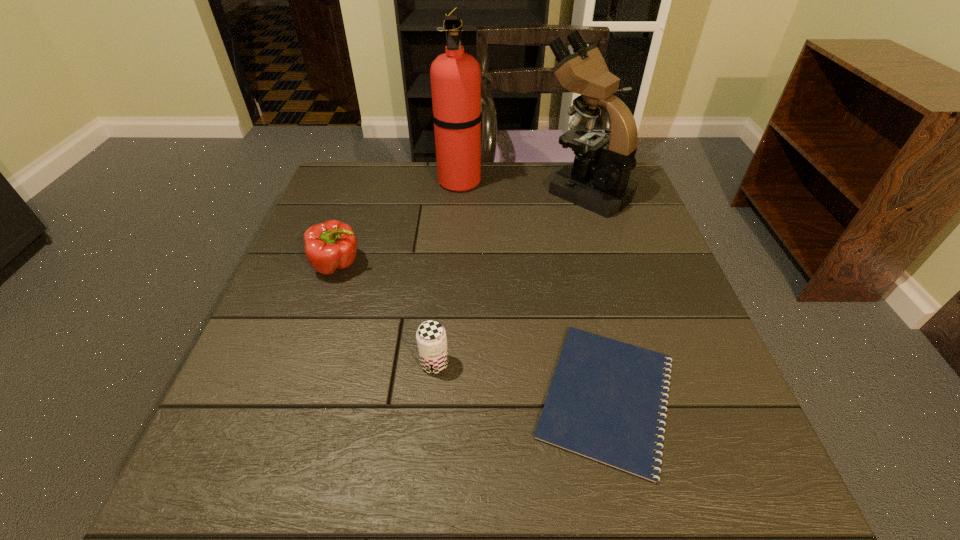
The width and height of the screenshot is (960, 540). What are the coordinates of `blank area at the near edge` in the screenshot? It's located at (593, 490).

At what (x,y) coordinates should I click in order to perform the action: click on vacant space at the left edge of the desktop. Please return your answer as a coordinate pair (x, y). This screenshot has width=960, height=540. Looking at the image, I should click on (286, 302).

Identify the location of free point at the right edge. (642, 206).

Image resolution: width=960 pixels, height=540 pixels. In the image, there is a desktop. Identify the location of vacant area at the far left corner. (382, 171).

Identify the location of free space at the near right corner. (716, 509).

The height and width of the screenshot is (540, 960). I want to click on vacant region between the shortest object and the microscope, so click(x=596, y=293).

The image size is (960, 540). I want to click on vacant area between the fourth tallest object and the second tallest object, so click(510, 277).

Where is `unoccupied area between the notepad and the second tallest object`? This screenshot has height=540, width=960. unoccupied area between the notepad and the second tallest object is located at coordinates (596, 293).

At what (x,y) coordinates should I click in order to perform the action: click on free space between the beer can and the shortest object. Please return your answer as a coordinate pair (x, y). This screenshot has height=540, width=960. Looking at the image, I should click on [x=520, y=380].

This screenshot has height=540, width=960. In order to click on free space that is in between the pepper and the fire extinguisher in this screenshot , I will do `click(398, 223)`.